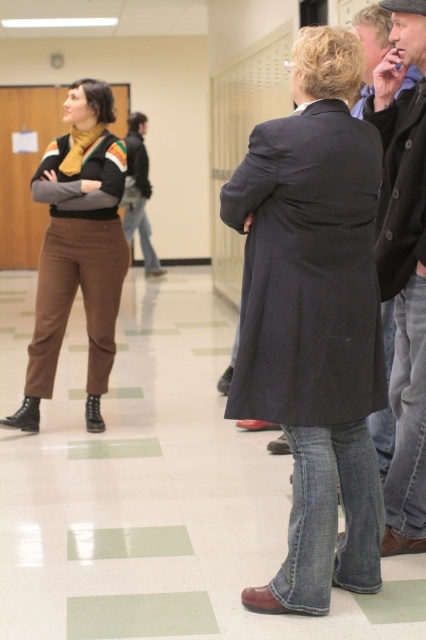
You are a student carrying a backpack and need to pass through the hallway. There is a dark gray wool coat at center and a matte brown pants at left in your path. Which object is smaller and might be easier to navigate around?

The dark gray wool coat at center is smaller in size compared to the matte brown pants at left, so it might be easier to navigate around.

In the scene shown: You are a student trying to find your way to the classroom. You see the matte brown pants at left and the dark gray jacket at center. Which direction should you walk to get closer to the classroom door located on the right side of the hallway?

Since the matte brown pants at left is to the right of the dark gray jacket at center, the classroom door on the right side of the hallway is likely further to the right beyond the matte brown pants at left. Therefore, you should walk towards the right past the matte brown pants at left to reach the classroom door.